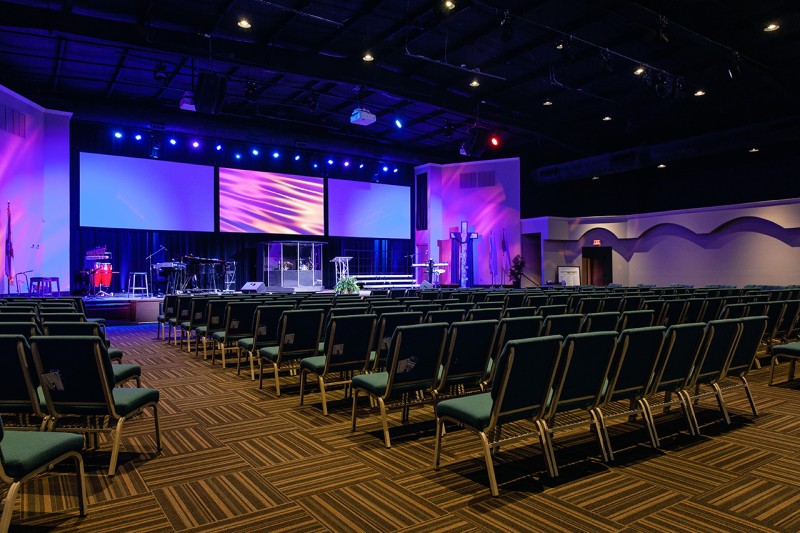
Find the location of a particular element. cushion is located at coordinates (37, 450).